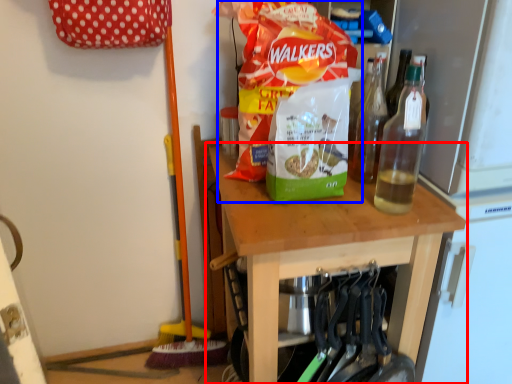
Question: Which point is closer to the camera, table (highlighted by a red box) or waste (highlighted by a blue box)?

Choices:
 (A) table
 (B) waste

Answer: (A)